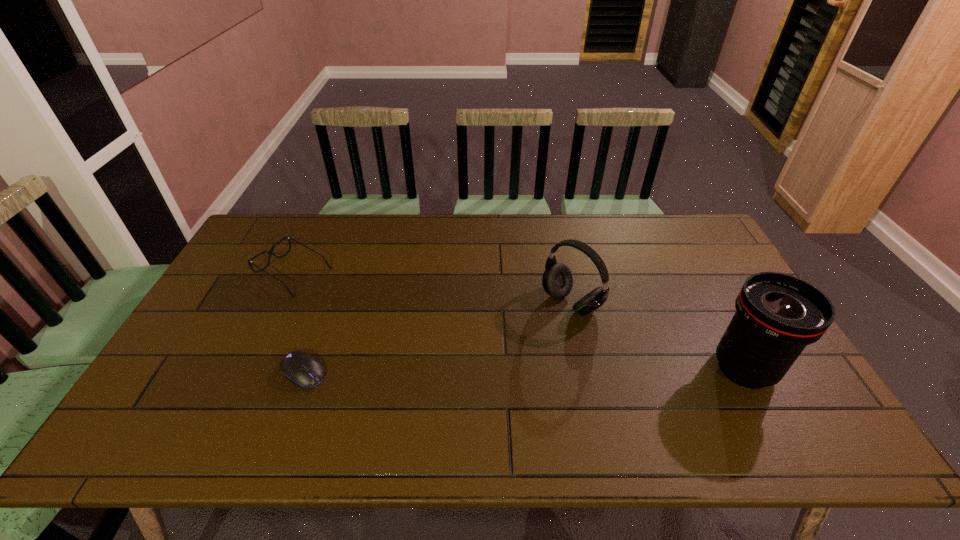
Find the location of a particular element. This screenshot has height=540, width=960. the shortest object is located at coordinates (301, 368).

Identify the location of telephoto lens. (777, 315).

Where is `the third tallest object`? the third tallest object is located at coordinates (270, 251).

Find the location of `the second object from right to left`. the second object from right to left is located at coordinates (557, 280).

Find the location of a particular element. This screenshot has width=960, height=540. headset is located at coordinates (557, 280).

What are the coordinates of `blank space located on the left of the shortest object` in the screenshot? It's located at (210, 373).

The height and width of the screenshot is (540, 960). Find the location of `vacant region located on the back of the rightmost object`. vacant region located on the back of the rightmost object is located at coordinates (705, 295).

This screenshot has height=540, width=960. I want to click on vacant space situated with the lenses facing outward on the third tallest object, so click(339, 295).

Locate an element on the screen. This screenshot has height=540, width=960. free space located with the lenses facing outward on the third tallest object is located at coordinates point(392,323).

This screenshot has height=540, width=960. What are the coordinates of `free space located 0.270m with the lenses facing outward on the third tallest object` in the screenshot? It's located at (387, 321).